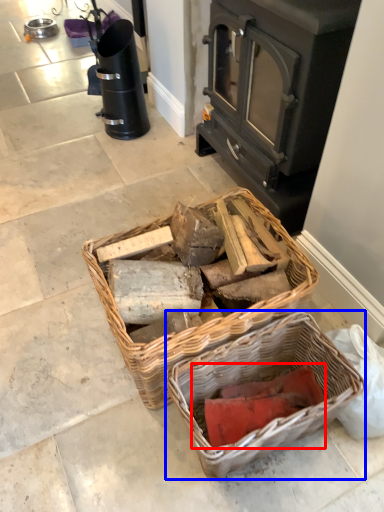
Question: Among these objects, which one is farthest to the camera, debris (highlighted by a red box) or picnic basket (highlighted by a blue box)?

Choices:
 (A) debris
 (B) picnic basket

Answer: (A)